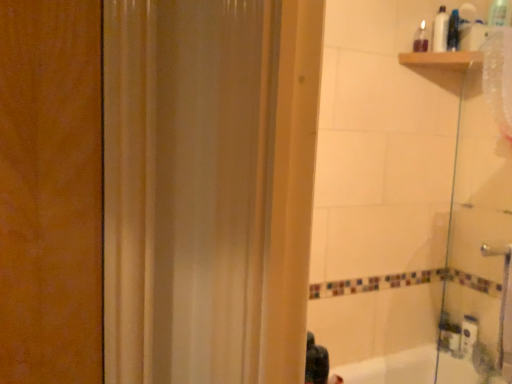
Image resolution: width=512 pixels, height=384 pixels. I want to click on white plastic bottle at upper right, the second toiletry when ordered from left to right, so click(x=440, y=30).

At what (x,y) coordinates should I click in order to perform the action: click on black matte hair at lower center. Please return your answer as a coordinate pair (x, y). The width and height of the screenshot is (512, 384). Looking at the image, I should click on (316, 362).

Locate an element on the screen. The image size is (512, 384). translucent plastic bottle at upper right, the first toiletry positioned from the left is located at coordinates (421, 39).

Consider the image. In order to face transparent glass shower door at right, should I rotate leftwards or rightwards?

A 29.374 degree turn to the right will do.

Find the location of `translucent plastic bottle at upper right, the first toiletry in the right-to-left sequence`. translucent plastic bottle at upper right, the first toiletry in the right-to-left sequence is located at coordinates (453, 31).

Identify the location of white plastic bottle at upper right, acting as the 2th toiletry starting from the right. (440, 30).

Find the location of a particular element. This screenshot has height=384, width=512. person located in front of the translucent plastic bottle at upper right, the first toiletry positioned from the left is located at coordinates (316, 362).

Considering the sizes of objects translucent plastic bottle at upper right, the first toiletry positioned from the left, and black matte hair at lower center in the image provided, who is thinner, translucent plastic bottle at upper right, the first toiletry positioned from the left, or black matte hair at lower center?

Thinner between the two is black matte hair at lower center.

Is translucent plastic bottle at upper right, positioned as the 3th toiletry in right-to-left order, positioned with its back to black matte hair at lower center?

No, translucent plastic bottle at upper right, positioned as the 3th toiletry in right-to-left order, is not facing away from black matte hair at lower center.

How different are the orientations of black matte hair at lower center and translucent plastic bottle at upper right, the first toiletry positioned from the left, in degrees?

The angular difference between black matte hair at lower center and translucent plastic bottle at upper right, the first toiletry positioned from the left, is 132 degrees.

Could you tell me if black matte hair at lower center is turned towards translucent plastic bottle at upper right, the first toiletry positioned from the left?

No, black matte hair at lower center is not turned towards translucent plastic bottle at upper right, the first toiletry positioned from the left.

Is point (305, 368) behind point (418, 34)?

No.

Considering the sizes of black matte hair at lower center and translucent plastic bottle at upper right, the first toiletry positioned from the left, in the image, is black matte hair at lower center wider or thinner than translucent plastic bottle at upper right, the first toiletry positioned from the left,?

In the image, black matte hair at lower center appears to be more narrow than translucent plastic bottle at upper right, the first toiletry positioned from the left.

From a real-world perspective, which object rests below the other?

translucent plastic bottle at upper right, positioned as the 3th toiletry in right-to-left order, is physically lower.

Is translucent plastic bottle at upper right, positioned as the 3th toiletry in right-to-left order, a part of white plastic bottle at upper right, the second toiletry when ordered from left to right?

Definitely not — translucent plastic bottle at upper right, positioned as the 3th toiletry in right-to-left order, is not inside white plastic bottle at upper right, the second toiletry when ordered from left to right.

Does white plastic bottle at upper right, acting as the 2th toiletry starting from the right, touch translucent plastic bottle at upper right, the first toiletry positioned from the left?

Yes, white plastic bottle at upper right, acting as the 2th toiletry starting from the right, is touching translucent plastic bottle at upper right, the first toiletry positioned from the left.

What's the angular difference between white plastic bottle at upper right, acting as the 2th toiletry starting from the right, and translucent plastic bottle at upper right, the first toiletry positioned from the left,'s facing directions?

white plastic bottle at upper right, acting as the 2th toiletry starting from the right, and translucent plastic bottle at upper right, the first toiletry positioned from the left, are facing 16.1 degrees away from each other.

Can you tell me how much translucent plastic bottle at upper right, the first toiletry positioned from the left, and transparent glass shower door at right differ in facing direction?

The angular difference between translucent plastic bottle at upper right, the first toiletry positioned from the left, and transparent glass shower door at right is 41.5 degrees.

Could you tell me if translucent plastic bottle at upper right, positioned as the 3th toiletry in right-to-left order, is turned towards transparent glass shower door at right?

No, translucent plastic bottle at upper right, positioned as the 3th toiletry in right-to-left order, is not turned towards transparent glass shower door at right.

How distant is translucent plastic bottle at upper right, the first toiletry positioned from the left, from transparent glass shower door at right?

They are 31.97 inches apart.

Can you confirm if translucent plastic bottle at upper right, the first toiletry positioned from the left, is positioned to the left of transparent glass shower door at right?

Yes, translucent plastic bottle at upper right, the first toiletry positioned from the left, is to the left of transparent glass shower door at right.

Is translucent plastic bottle at upper right, positioned as the third toiletry in left-to-right order, wider or thinner than black matte hair at lower center?

In the image, translucent plastic bottle at upper right, positioned as the third toiletry in left-to-right order, appears to be wider than black matte hair at lower center.

Which is more to the right, translucent plastic bottle at upper right, positioned as the third toiletry in left-to-right order, or black matte hair at lower center?

translucent plastic bottle at upper right, positioned as the third toiletry in left-to-right order.

From a real-world perspective, is translucent plastic bottle at upper right, the first toiletry in the right-to-left sequence, over black matte hair at lower center?

Yes.

Between translucent plastic bottle at upper right, the first toiletry in the right-to-left sequence, and black matte hair at lower center, which one has more height?

With more height is translucent plastic bottle at upper right, the first toiletry in the right-to-left sequence.

Based on the photo, is white plastic bottle at upper right, acting as the 2th toiletry starting from the right, oriented away from transparent glass shower door at right?

white plastic bottle at upper right, acting as the 2th toiletry starting from the right, is not turned away from transparent glass shower door at right.

From the transparent glass shower door at right, count 3rd toiletrys backward and point to it. Please provide its 2D coordinates.

[(440, 30)]

Is point (436, 31) closer to viewer compared to point (444, 342)?

Yes, it is in front of point (444, 342).

Which object is positioned more to the left, white plastic bottle at upper right, the second toiletry when ordered from left to right, or transparent glass shower door at right?

From the viewer's perspective, transparent glass shower door at right appears more on the left side.

At what (x,y) coordinates should I click in order to perform the action: click on shower door in front of the white plastic bottle at upper right, acting as the 2th toiletry starting from the right. Please return your answer as a coordinate pair (x, y). Looking at the image, I should click on (477, 247).

Considering the relative sizes of transparent glass shower door at right and white plastic bottle at upper right, the second toiletry when ordered from left to right, in the image provided, is transparent glass shower door at right taller than white plastic bottle at upper right, the second toiletry when ordered from left to right,?

Indeed, transparent glass shower door at right has a greater height compared to white plastic bottle at upper right, the second toiletry when ordered from left to right.

Between transparent glass shower door at right and white plastic bottle at upper right, acting as the 2th toiletry starting from the right, which one has smaller size?

white plastic bottle at upper right, acting as the 2th toiletry starting from the right, is smaller.

Find the location of a particular element. The image size is (512, 384). the 1st toiletry located above the black matte hair at lower center (from a real-world perspective) is located at coordinates (421, 39).

Identify the location of person directly beneath the translucent plastic bottle at upper right, the first toiletry positioned from the left (from a real-world perspective). This screenshot has height=384, width=512. (316, 362).

Consider the image. Which object lies further to the anchor point white plastic bottle at upper right, the second toiletry when ordered from left to right, translucent plastic bottle at upper right, positioned as the third toiletry in left-to-right order, or black matte hair at lower center?

black matte hair at lower center is positioned further to the anchor white plastic bottle at upper right, the second toiletry when ordered from left to right.

From the image, which object appears to be farther from black matte hair at lower center, translucent plastic bottle at upper right, the first toiletry in the right-to-left sequence, or white plastic bottle at upper right, the second toiletry when ordered from left to right?

Among the two, translucent plastic bottle at upper right, the first toiletry in the right-to-left sequence, is located further to black matte hair at lower center.

Based on their spatial positions, is translucent plastic bottle at upper right, the first toiletry in the right-to-left sequence, or transparent glass shower door at right closer to black matte hair at lower center?

transparent glass shower door at right is closer to black matte hair at lower center.

When comparing their distances from white plastic bottle at upper right, acting as the 2th toiletry starting from the right, does transparent glass shower door at right or black matte hair at lower center seem further?

Based on the image, black matte hair at lower center appears to be further to white plastic bottle at upper right, acting as the 2th toiletry starting from the right.

Based on the photo, when comparing their distances from translucent plastic bottle at upper right, the first toiletry in the right-to-left sequence, does black matte hair at lower center or translucent plastic bottle at upper right, the first toiletry positioned from the left, seem further?

black matte hair at lower center is further to translucent plastic bottle at upper right, the first toiletry in the right-to-left sequence.

Which object lies nearer to the anchor point black matte hair at lower center, translucent plastic bottle at upper right, the first toiletry positioned from the left, or white plastic bottle at upper right, the second toiletry when ordered from left to right?

translucent plastic bottle at upper right, the first toiletry positioned from the left, is positioned closer to the anchor black matte hair at lower center.

In the scene shown: From the image, which object appears to be farther from translucent plastic bottle at upper right, positioned as the 3th toiletry in right-to-left order, black matte hair at lower center or white plastic bottle at upper right, the second toiletry when ordered from left to right?

black matte hair at lower center is further to translucent plastic bottle at upper right, positioned as the 3th toiletry in right-to-left order.

Considering their positions, is transparent glass shower door at right positioned closer to black matte hair at lower center than translucent plastic bottle at upper right, the first toiletry in the right-to-left sequence?

transparent glass shower door at right lies closer to black matte hair at lower center than the other object.

Locate an element on the screen. The height and width of the screenshot is (384, 512). shower door positioned between black matte hair at lower center and translucent plastic bottle at upper right, the first toiletry positioned from the left, from near to far is located at coordinates (477, 247).

At what (x,y) coordinates should I click in order to perform the action: click on toiletry between translucent plastic bottle at upper right, the first toiletry positioned from the left, and translucent plastic bottle at upper right, the first toiletry in the right-to-left sequence, from left to right. Please return your answer as a coordinate pair (x, y). Looking at the image, I should click on (440, 30).

What are the coordinates of `shower door between black matte hair at lower center and white plastic bottle at upper right, the second toiletry when ordered from left to right, in the front-back direction` in the screenshot? It's located at (477, 247).

Identify the location of toiletry between translucent plastic bottle at upper right, positioned as the third toiletry in left-to-right order, and transparent glass shower door at right vertically. This screenshot has height=384, width=512. (421, 39).